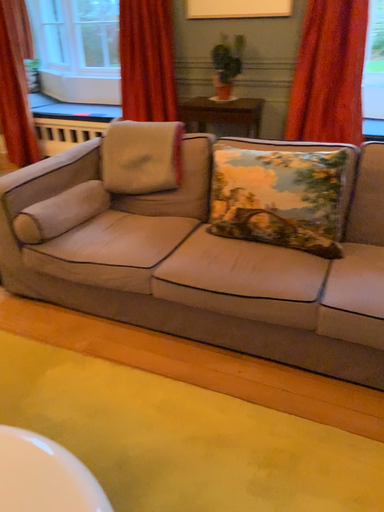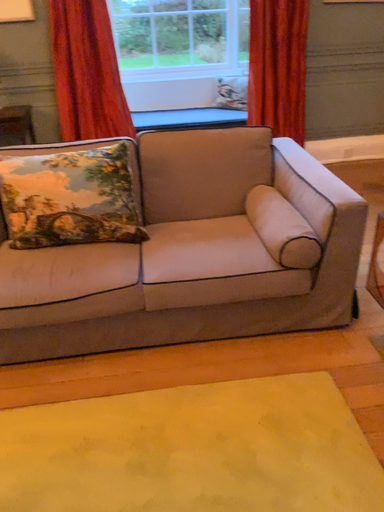
Question: Which way did the camera rotate in the video?

Choices:
 (A) rotated right
 (B) rotated left

Answer: (A)